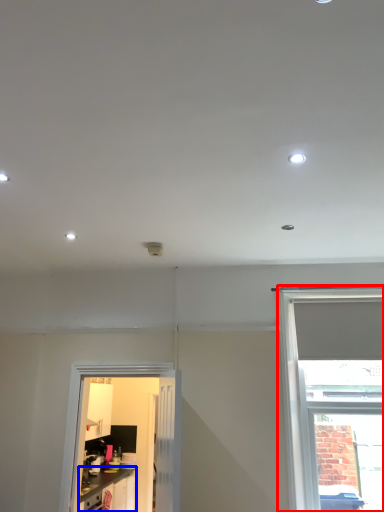
Question: Among these objects, which one is nearest to the camera, window (highlighted by a red box) or cabinetry (highlighted by a blue box)?

Choices:
 (A) window
 (B) cabinetry

Answer: (A)